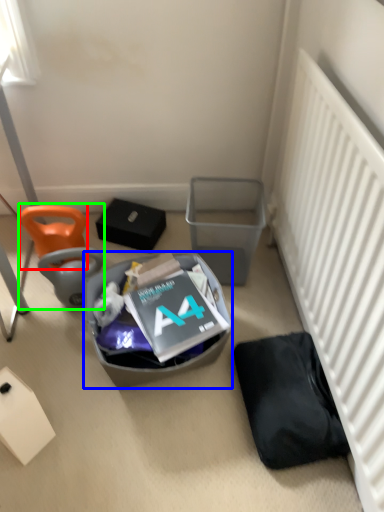
Question: Which object is the farthest from bean bag chair (highlighted by a red box)? Choose among these: trash bin/can (highlighted by a blue box) or bean bag chair (highlighted by a green box).

Choices:
 (A) trash bin/can
 (B) bean bag chair

Answer: (A)